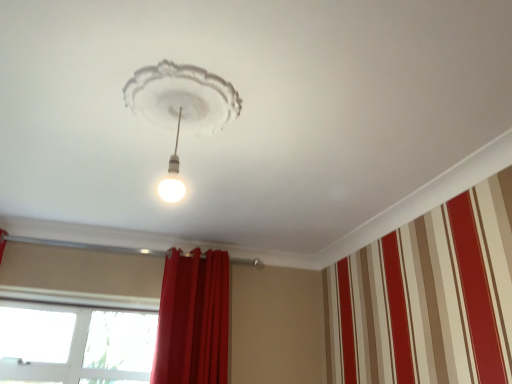
Question: Is white glossy light bulb at center not within transparent glass window at lower left?

Choices:
 (A) no
 (B) yes

Answer: (B)

Question: From the image's perspective, is white glossy light bulb at center below transparent glass window at lower left?

Choices:
 (A) no
 (B) yes

Answer: (A)

Question: Is white glossy light bulb at center taller than transparent glass window at lower left?

Choices:
 (A) no
 (B) yes

Answer: (A)

Question: Considering the relative sizes of white glossy light bulb at center and transparent glass window at lower left in the image provided, is white glossy light bulb at center thinner than transparent glass window at lower left?

Choices:
 (A) no
 (B) yes

Answer: (A)

Question: Would you say white glossy light bulb at center is a long distance from transparent glass window at lower left?

Choices:
 (A) no
 (B) yes

Answer: (B)

Question: From a real-world perspective, is transparent glass window at lower left positioned above or below red velvet curtain at center?

Choices:
 (A) above
 (B) below

Answer: (B)

Question: From the image's perspective, relative to red velvet curtain at center, is transparent glass window at lower left above or below?

Choices:
 (A) above
 (B) below

Answer: (B)

Question: Based on their positions, is transparent glass window at lower left located to the left or right of red velvet curtain at center?

Choices:
 (A) right
 (B) left

Answer: (B)

Question: Is point (28, 375) positioned closer to the camera than point (172, 347)?

Choices:
 (A) farther
 (B) closer

Answer: (A)

Question: In the image, is red velvet curtain at center on the left side or the right side of transparent glass window at lower left?

Choices:
 (A) left
 (B) right

Answer: (B)

Question: Is red velvet curtain at center taller or shorter than transparent glass window at lower left?

Choices:
 (A) tall
 (B) short

Answer: (A)

Question: Choose the correct answer: Is red velvet curtain at center inside transparent glass window at lower left or outside it?

Choices:
 (A) inside
 (B) outside

Answer: (B)

Question: From a real-world perspective, is red velvet curtain at center physically located above or below transparent glass window at lower left?

Choices:
 (A) below
 (B) above

Answer: (B)

Question: Considering the positions of transparent glass window at lower left and white glossy light bulb at center in the image, is transparent glass window at lower left wider or thinner than white glossy light bulb at center?

Choices:
 (A) wide
 (B) thin

Answer: (B)

Question: Is transparent glass window at lower left inside the boundaries of white glossy light bulb at center, or outside?

Choices:
 (A) outside
 (B) inside

Answer: (A)